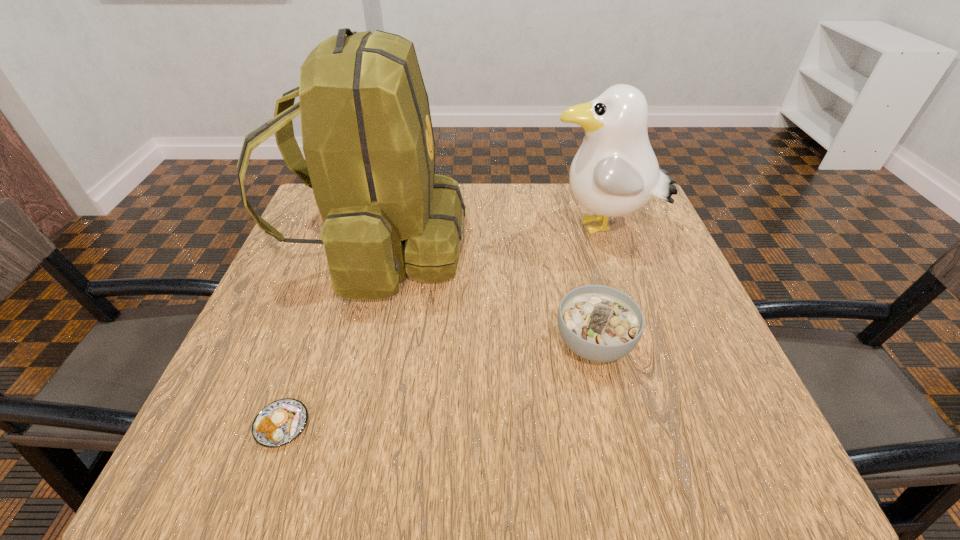
I want to click on free space between the pastry and the second shortest object, so click(438, 384).

Find the location of `free area in between the tallest object and the pastry`. free area in between the tallest object and the pastry is located at coordinates (329, 336).

Choose which object is the second nearest neighbor to the pastry. Please provide its 2D coordinates. Your answer should be formatted as a tuple, i.e. [(x, y)], where the tuple contains the x and y coordinates of a point satisfying the conditions above.

[(599, 323)]

Point out which object is positioned as the third nearest to the third tallest object. Please provide its 2D coordinates. Your answer should be formatted as a tuple, i.e. [(x, y)], where the tuple contains the x and y coordinates of a point satisfying the conditions above.

[(280, 422)]

Image resolution: width=960 pixels, height=540 pixels. What are the coordinates of `vacant area that satisfies the following two spatial constraints: 1. on the front-facing side of the backpack; 2. on the right side of the soup bowl` in the screenshot? It's located at (350, 343).

Where is `free space that satisfies the following two spatial constraints: 1. on the back side of the soup bowl; 2. on the left side of the shortest object`? free space that satisfies the following two spatial constraints: 1. on the back side of the soup bowl; 2. on the left side of the shortest object is located at coordinates (311, 343).

Locate an element on the screen. This screenshot has width=960, height=540. vacant position in the image that satisfies the following two spatial constraints: 1. on the back side of the second nearest object; 2. on the front-facing side of the tallest object is located at coordinates (570, 247).

Locate an element on the screen. The height and width of the screenshot is (540, 960). vacant area in the image that satisfies the following two spatial constraints: 1. on the beak of the second tallest object; 2. on the front side of the third tallest object is located at coordinates tap(640, 343).

I want to click on free space that satisfies the following two spatial constraints: 1. on the beak of the third shortest object; 2. on the front side of the second nearest object, so click(x=640, y=343).

What are the coordinates of `vacant space that satisfies the following two spatial constraints: 1. on the beak of the third shortest object; 2. on the front side of the nearest object` in the screenshot? It's located at (667, 425).